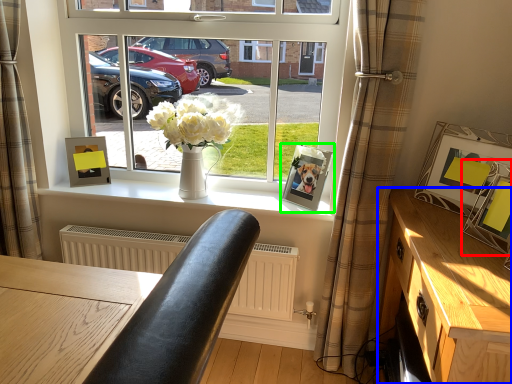
Question: Estimate the real-world distances between objects in this image. Which object is farther from picture frame (highlighted by a red box), table (highlighted by a blue box) or picture frame (highlighted by a green box)?

Choices:
 (A) table
 (B) picture frame

Answer: (B)